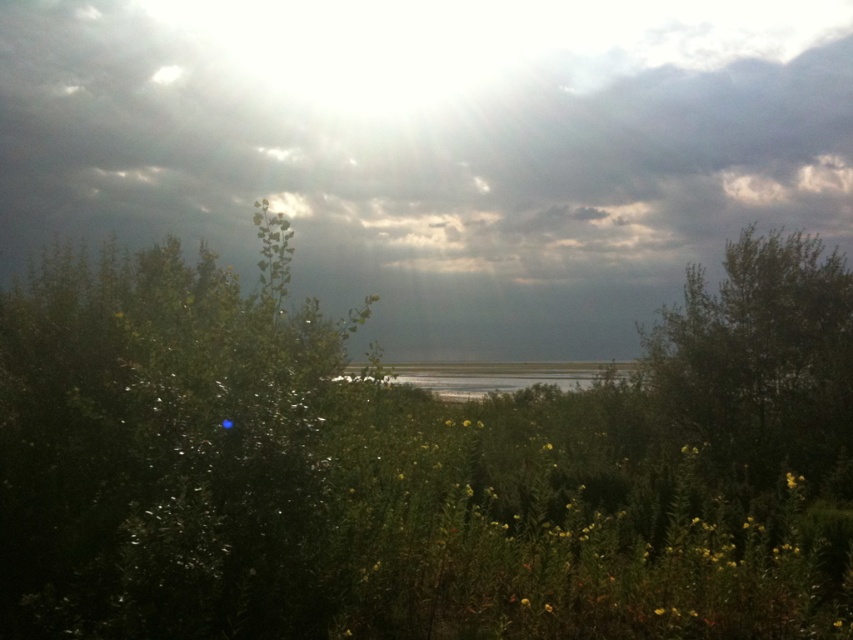
Based on the scene description, which object is located at the coordinates point (434, 147)?

The point (434, 147) corresponds to the gray cloudy sky at upper center.

You are standing at the edge of the green grassy lake at center and want to see the green leafy bush at left. Which direction should you turn to look towards it?

The green leafy bush at left is located to your left side relative to the green grassy lake at center, so you should turn to your left to see it.